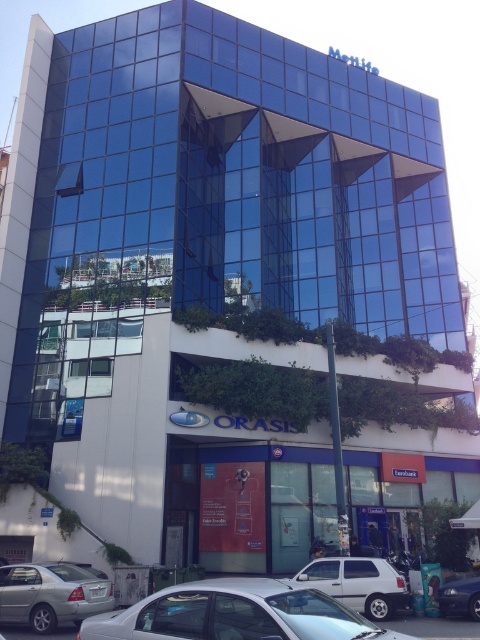
Does white matte car at lower center come behind shiny blue sedan at lower right?

That is False.

Between white matte car at lower center and shiny blue sedan at lower right, which one appears on the left side from the viewer's perspective?

white matte car at lower center

Is point (320, 557) farther from viewer compared to point (472, 612)?

Yes, point (320, 557) is behind point (472, 612).

At what (x,y) coordinates should I click in order to perform the action: click on white matte car at lower center. Please return your answer as a coordinate pair (x, y). This screenshot has height=640, width=480. Looking at the image, I should click on (359, 582).

Does silver metallic sedan at lower left have a greater width compared to shiny blue sedan at lower right?

Correct, the width of silver metallic sedan at lower left exceeds that of shiny blue sedan at lower right.

Which is more to the left, silver metallic sedan at lower left or shiny blue sedan at lower right?

From the viewer's perspective, silver metallic sedan at lower left appears more on the left side.

What do you see at coordinates (50, 595) in the screenshot?
I see `silver metallic sedan at lower left` at bounding box center [50, 595].

The height and width of the screenshot is (640, 480). What are the coordinates of `silver metallic sedan at lower left` in the screenshot? It's located at (50, 595).

Is point (100, 588) positioned behind point (344, 588)?

No, it is in front of (344, 588).

Does silver metallic sedan at lower left have a greater width compared to white matte car at lower center?

Correct, the width of silver metallic sedan at lower left exceeds that of white matte car at lower center.

Which is behind, point (25, 586) or point (348, 557)?

Positioned behind is point (348, 557).

At what (x,y) coordinates should I click in order to perform the action: click on silver metallic sedan at lower left. Please return your answer as a coordinate pair (x, y). The height and width of the screenshot is (640, 480). Looking at the image, I should click on (50, 595).